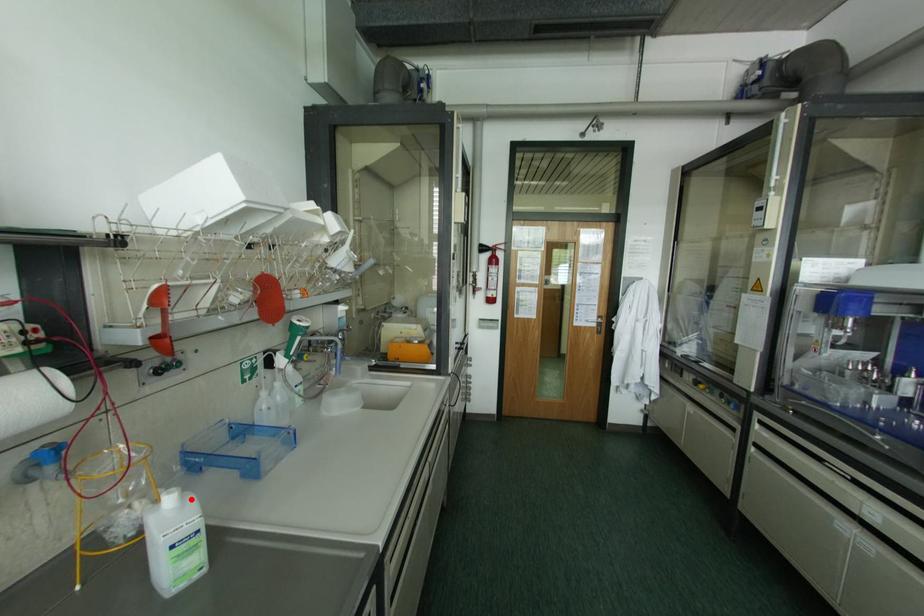
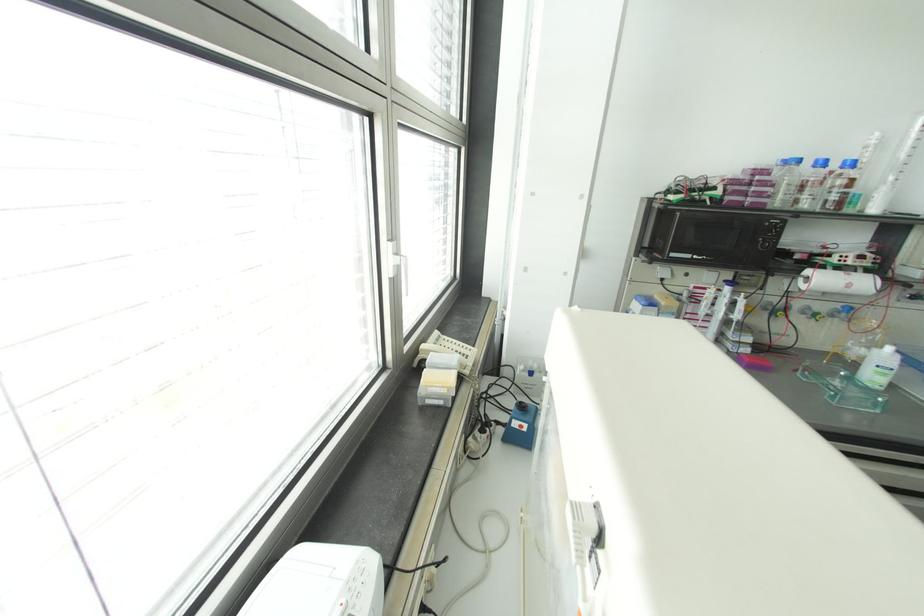
Question: I am providing you with two images of the same scene from different viewpoints. In image1, a red point is highlighted. Considering the same 3D point in image2, which of the following is correct?

Choices:
 (A) It is closer
 (B) It is farther

Answer: (A)